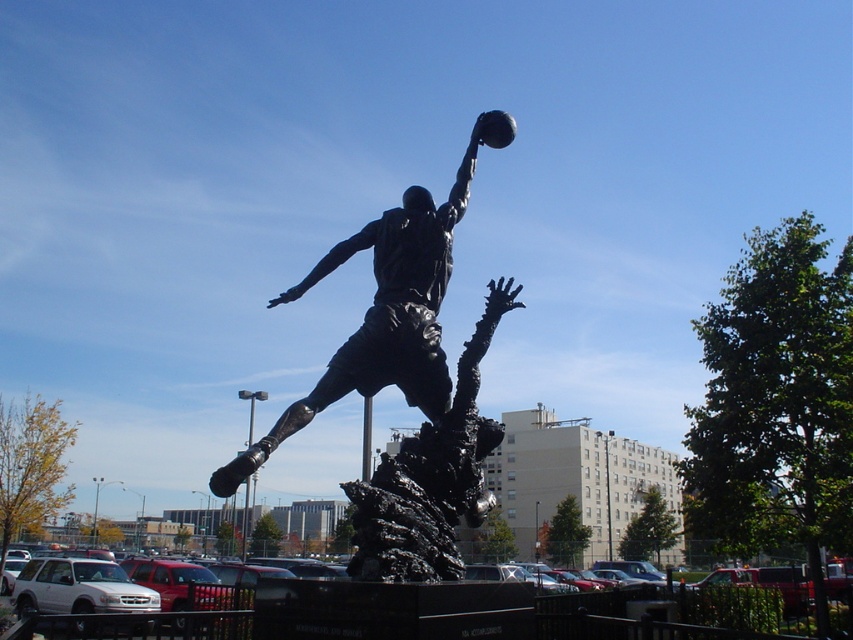
Question: Which object is closer to the camera taking this photo?

Choices:
 (A) bronze statue at center
 (B) black asphalt parking lot at center

Answer: (B)

Question: Can you confirm if bronze statue at center is smaller than black asphalt parking lot at center?

Choices:
 (A) yes
 (B) no

Answer: (A)

Question: Which point is closer to the camera?

Choices:
 (A) bronze statue at center
 (B) black asphalt parking lot at center

Answer: (B)

Question: Is bronze statue at center to the right of black asphalt parking lot at center from the viewer's perspective?

Choices:
 (A) no
 (B) yes

Answer: (B)

Question: Is bronze statue at center bigger than black asphalt parking lot at center?

Choices:
 (A) no
 (B) yes

Answer: (A)